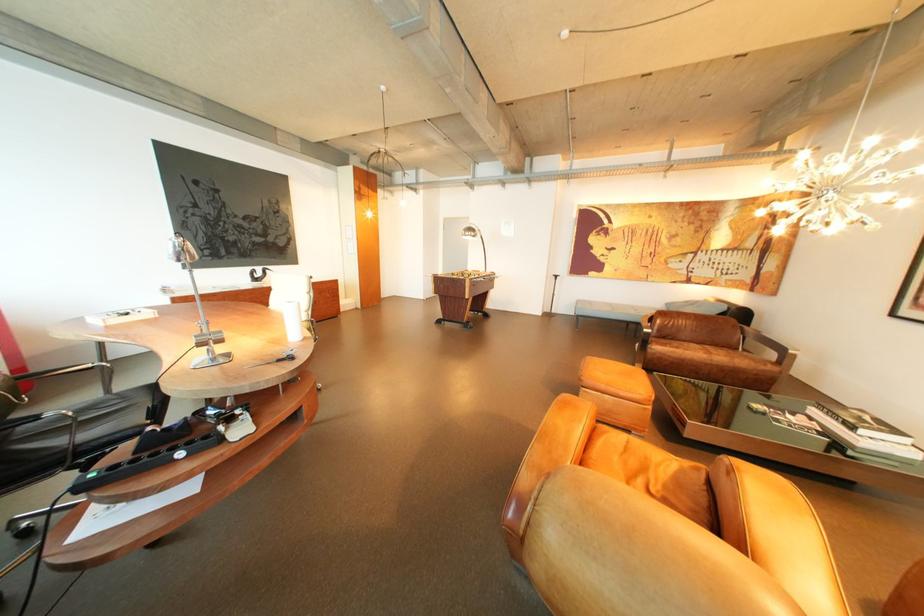
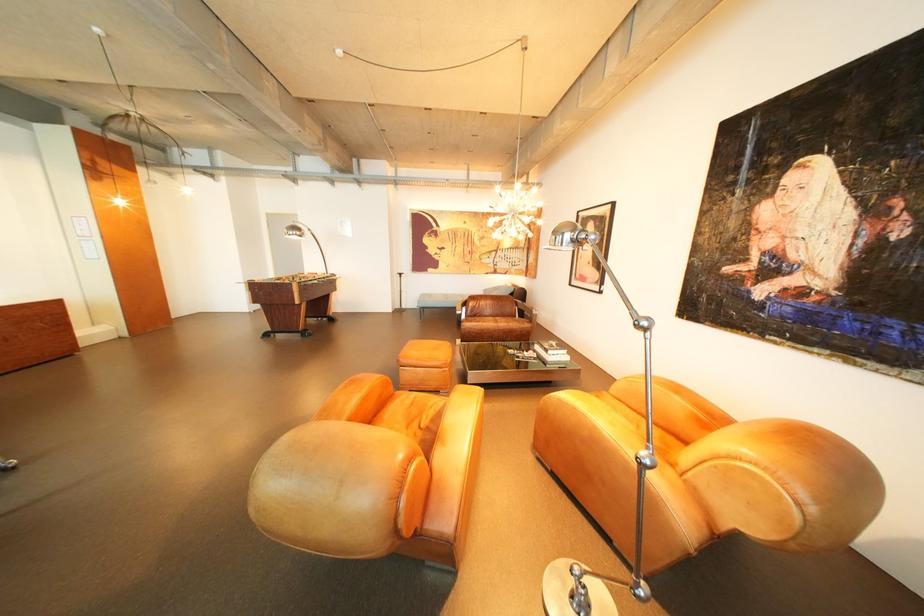
The point at (722, 353) is marked in the first image. Where is the corresponding point in the second image?

(509, 322)